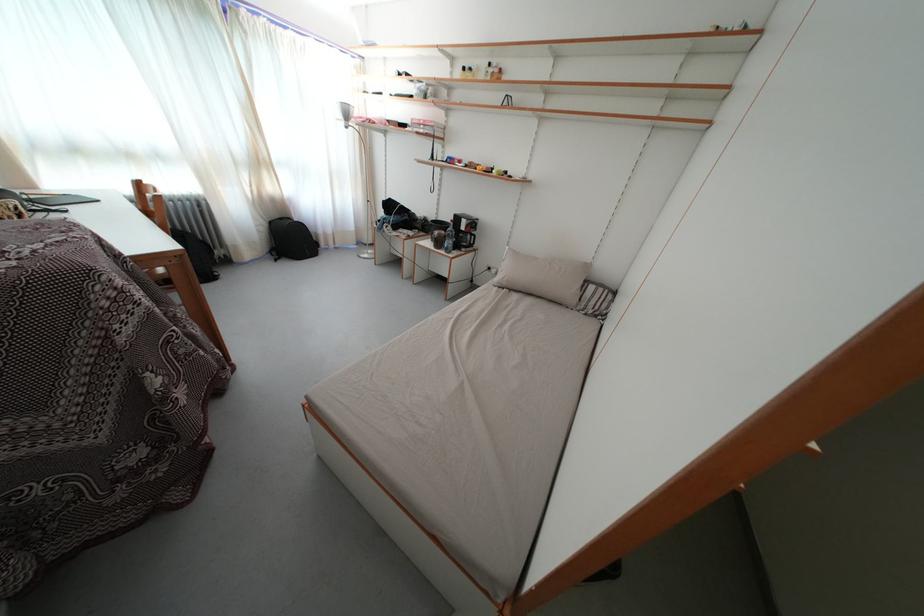
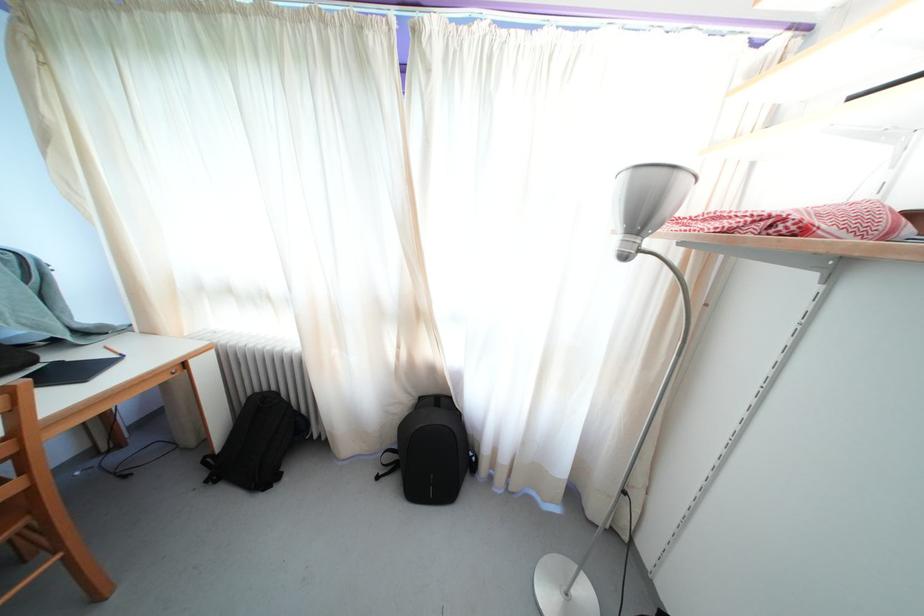
Locate, in the second image, the point that corresponds to (x=266, y=168) in the first image.

(421, 321)